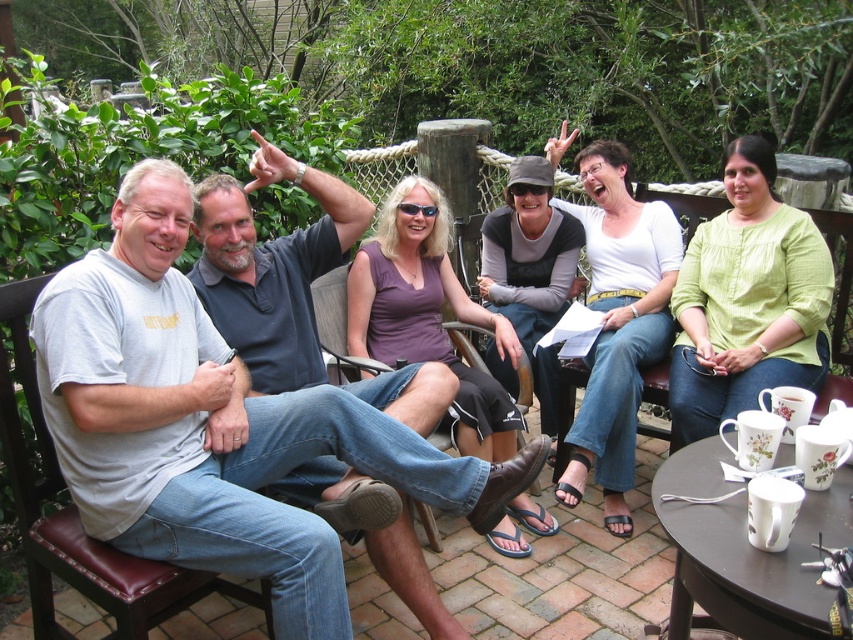
Question: Which point is closer to the camera?

Choices:
 (A) (334, 636)
 (B) (21, 492)

Answer: (A)

Question: Where is gray t-shirt at left located in relation to brown leather chair at center in the image?

Choices:
 (A) right
 (B) left

Answer: (B)

Question: Which point is closer to the camera?

Choices:
 (A) brown leather chair at center
 (B) gray t-shirt at left
 (C) brown leather chair at left

Answer: (B)

Question: Does gray t-shirt at left have a greater width compared to brown leather chair at left?

Choices:
 (A) yes
 (B) no

Answer: (A)

Question: Can you confirm if gray t-shirt at left is bigger than brown leather chair at center?

Choices:
 (A) no
 (B) yes

Answer: (B)

Question: Which of the following is the farthest from the observer?

Choices:
 (A) brown leather chair at left
 (B) gray t-shirt at left

Answer: (A)